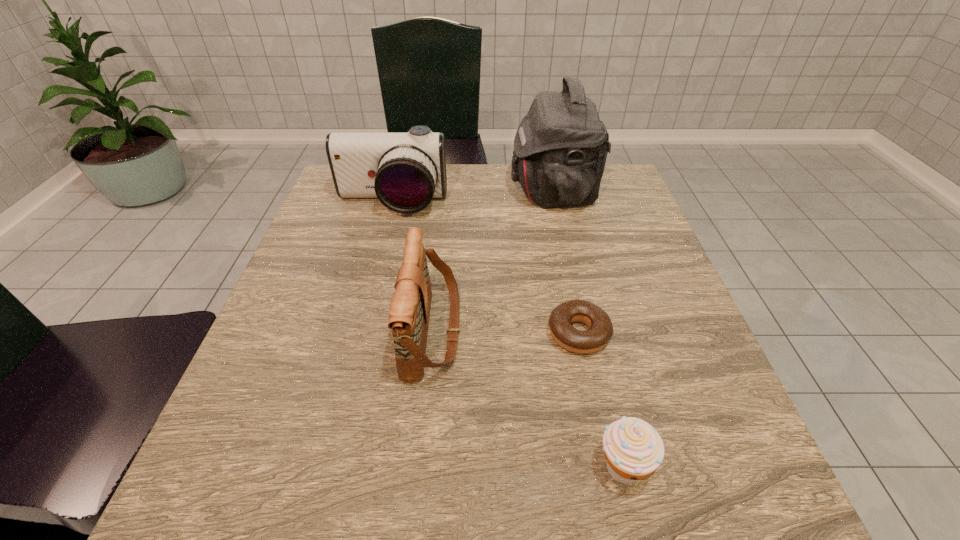
Identify the location of vacant space located on the open flap of the right shoulder bag. (454, 191).

At what (x,y) coordinates should I click in order to perform the action: click on free space located on the surface of the camcorder. Please return your answer as a coordinate pair (x, y). Looking at the image, I should click on (381, 243).

The image size is (960, 540). What are the coordinates of `vacant space situated 0.130m on the front-facing side of the shorter shoulder bag` in the screenshot? It's located at (529, 332).

The height and width of the screenshot is (540, 960). I want to click on free region located 0.100m on the back of the nearest object, so [603, 384].

You are a GUI agent. You are given a task and a screenshot of the screen. Output one action in this format:
    pyautogui.click(x=<x>, y=<y>)
    Task: Click on the vacant region located 0.170m on the left of the shortest object
    This screenshot has width=960, height=540.
    Given the screenshot: What is the action you would take?
    pyautogui.click(x=457, y=334)

Locate an element on the screen. shoulder bag present at the far edge is located at coordinates (560, 148).

You are a GUI agent. You are given a task and a screenshot of the screen. Output one action in this format:
    pyautogui.click(x=<x>, y=<y>)
    Task: Click on the camcorder that is at the far edge
    The image size is (960, 540).
    Given the screenshot: What is the action you would take?
    pyautogui.click(x=404, y=171)

Where is `object at the near edge`? object at the near edge is located at coordinates (633, 449).

Find the location of `object at the left edge`. object at the left edge is located at coordinates click(404, 171).

Where is `shoulder bag positioned at the right edge`? The image size is (960, 540). shoulder bag positioned at the right edge is located at coordinates click(x=560, y=148).